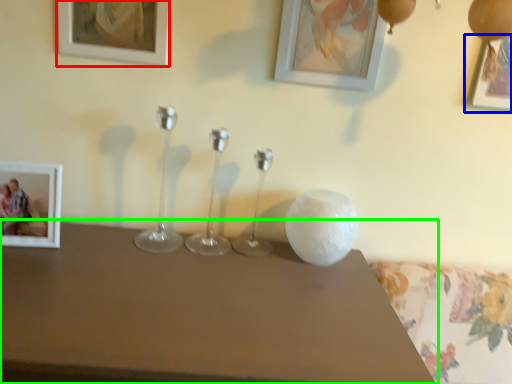
Question: Considering the real-world distances, which object is farthest from picture frame (highlighted by a red box)? picture frame (highlighted by a blue box) or table (highlighted by a green box)?

Choices:
 (A) picture frame
 (B) table

Answer: (A)